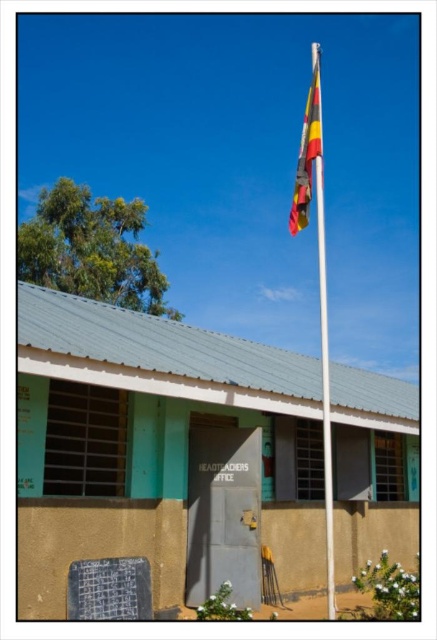
You are standing in front of the HEADTEACHERS OFFICE building and see the white plastic flag pole at center and the multicolored fabric flag at center. Which object is located to the right of the other?

The white plastic flag pole at center is positioned on the right side of multicolored fabric flag at center.

You are a visitor approaching the HEADTEACHERS OFFICE building. You notice the white plastic flag pole at center and the multicolored fabric flag at center. Which object is larger in size?

The white plastic flag pole at center is bigger than the multicolored fabric flag at center.

You are a visitor at the school and want to hang a new flag on the existing flagpole. The new flag is exactly the same size as the current multicolored fabric flag at center. Will the white plastic flag pole at center be tall enough to accommodate the new flag without needing to adjust the pole?

The white plastic flag pole at center is taller than the multicolored fabric flag at center, so the pole is tall enough to accommodate the new flag of the same size without needing adjustments.